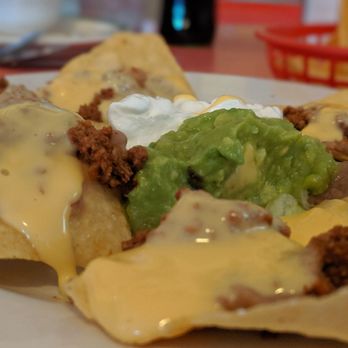
Image resolution: width=348 pixels, height=348 pixels. In order to click on red plastic basket in this screenshot , I will do `click(284, 43)`.